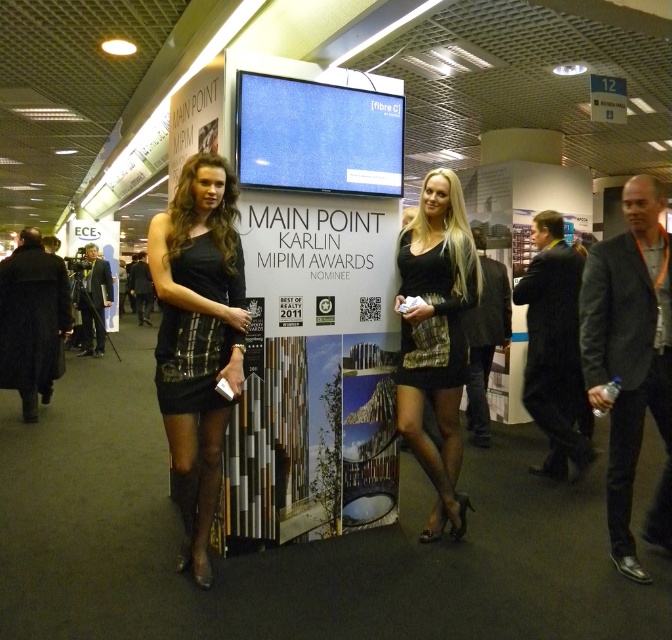
Question: Is black satin dress at center below matte black camera at left?

Choices:
 (A) yes
 (B) no

Answer: (A)

Question: Which object is the closest to the black plaid dress at center?

Choices:
 (A) shiny black dress at center
 (B) black satin dress at center
 (C) blue fabric screen at center
 (D) matte black camera at left

Answer: (A)

Question: Is shiny black dress at center below matte black camera at left?

Choices:
 (A) yes
 (B) no

Answer: (A)

Question: Which of these objects is positioned farthest from the blue fabric screen at center?

Choices:
 (A) black plaid dress at center
 (B) black satin dress at center
 (C) shiny black dress at center

Answer: (C)

Question: Among these objects, which one is farthest from the camera?

Choices:
 (A) shiny black dress at center
 (B) black satin dress at center
 (C) black plaid dress at left
 (D) black plaid dress at center

Answer: (D)

Question: Can you confirm if blue fabric screen at center is bigger than matte black camera at left?

Choices:
 (A) no
 (B) yes

Answer: (A)